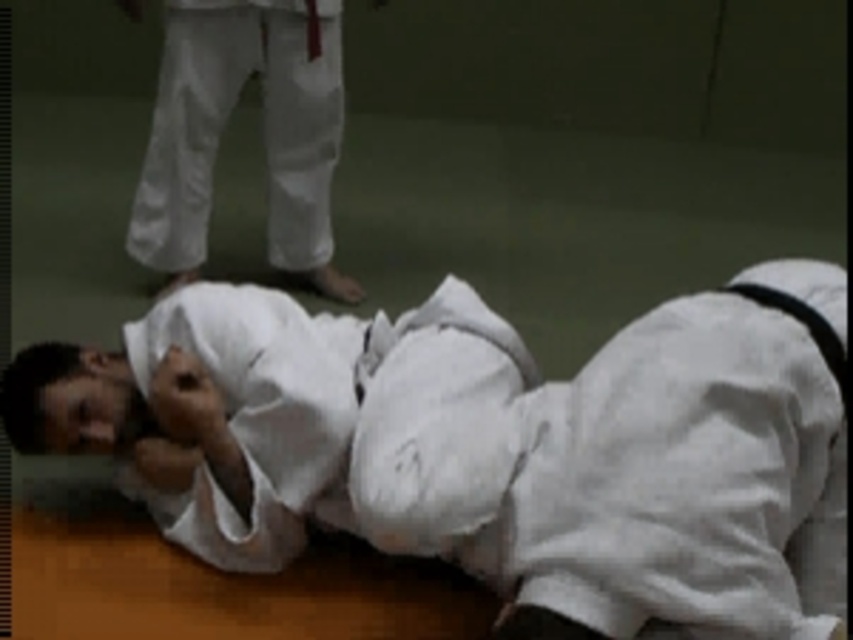
Between point (524, 577) and point (271, 109), which one is positioned behind?

The point (271, 109) is more distant.

Is point (780, 528) positioned after point (310, 29)?

No, it is not.

The width and height of the screenshot is (853, 640). What do you see at coordinates (483, 449) in the screenshot?
I see `white cloth kimono at lower left` at bounding box center [483, 449].

Identify the location of white cloth kimono at lower left. (483, 449).